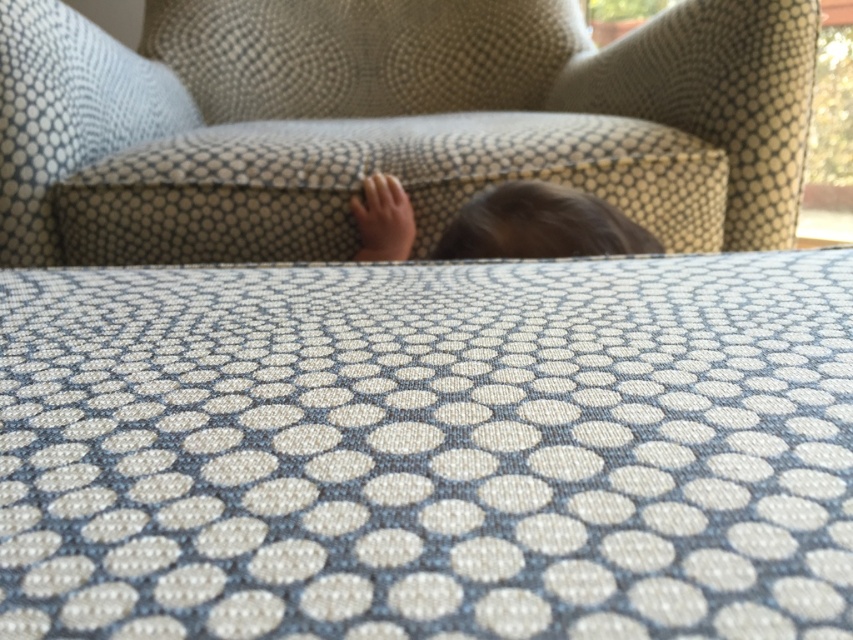
Question: Does textured fabric armchair at center appear on the left side of matte skin hand at center?

Choices:
 (A) no
 (B) yes

Answer: (A)

Question: Among these points, which one is nearest to the camera?

Choices:
 (A) coord(665,28)
 (B) coord(384,209)

Answer: (B)

Question: Can you confirm if textured fabric armchair at center is bigger than matte skin hand at center?

Choices:
 (A) no
 (B) yes

Answer: (B)

Question: Among these points, which one is nearest to the camera?

Choices:
 (A) (369, 244)
 (B) (709, 120)
 (C) (521, 220)

Answer: (C)

Question: Which of these objects is positioned farthest from the textured fabric armchair at center?

Choices:
 (A) brown hair at center
 (B) matte skin hand at center

Answer: (B)

Question: Can you confirm if textured fabric armchair at center is wider than brown hair at center?

Choices:
 (A) yes
 (B) no

Answer: (A)